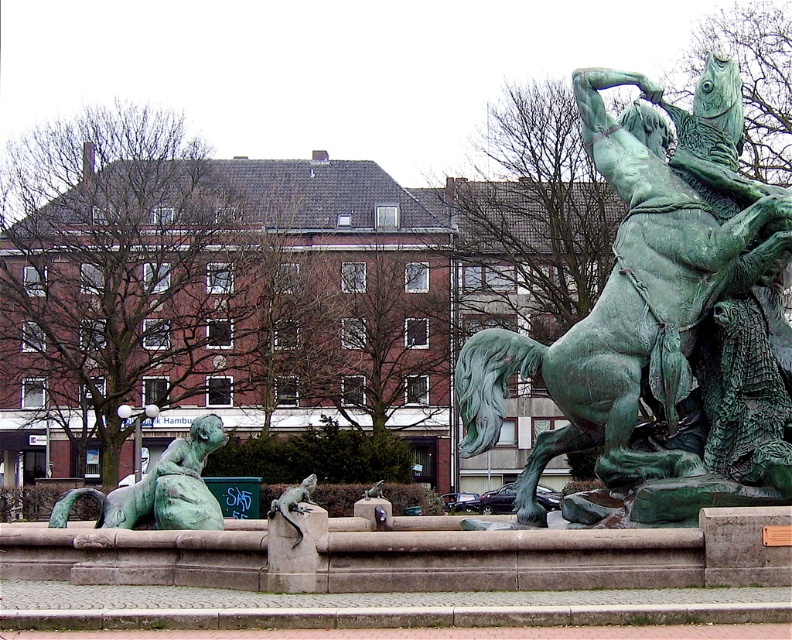
Question: Among these objects, which one is nearest to the camera?

Choices:
 (A) green patina horse at center
 (B) green patina statue at lower left

Answer: (A)

Question: Does green patina horse at center have a greater width compared to green patina statue at lower left?

Choices:
 (A) yes
 (B) no

Answer: (A)

Question: From the image, what is the correct spatial relationship of green patina horse at center in relation to green patina statue at lower left?

Choices:
 (A) above
 (B) below

Answer: (A)

Question: Which of the following is the closest to the observer?

Choices:
 (A) green patina horse at center
 (B) green patina statue at lower left

Answer: (A)

Question: Is green patina horse at center bigger than green patina statue at lower left?

Choices:
 (A) yes
 (B) no

Answer: (A)